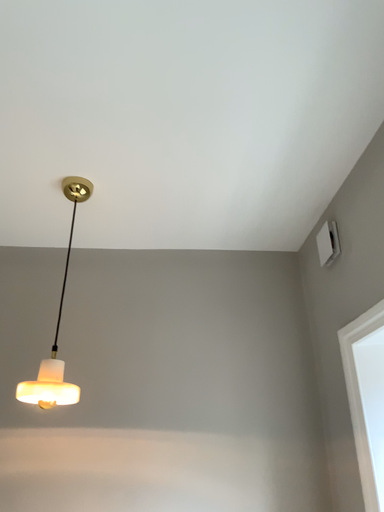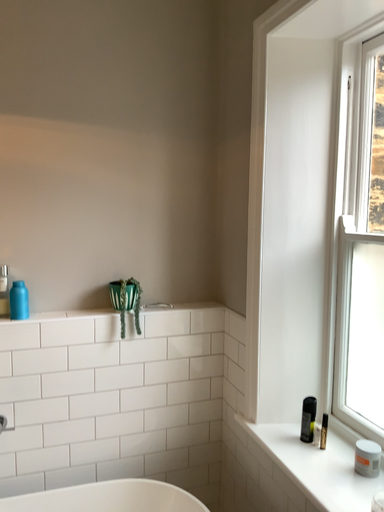
Question: How did the camera likely rotate when shooting the video?

Choices:
 (A) rotated downward
 (B) rotated upward

Answer: (A)